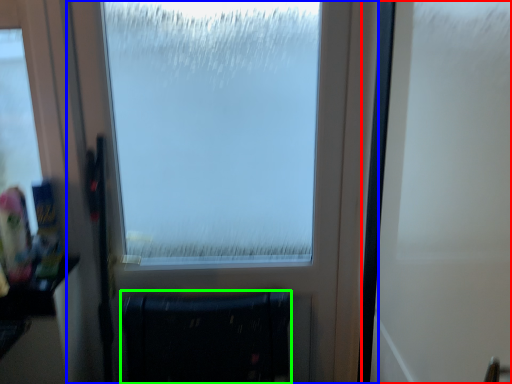
Question: Considering the real-world distances, which object is closest to screen door (highlighted by a red box)? window (highlighted by a blue box) or furniture (highlighted by a green box).

Choices:
 (A) window
 (B) furniture

Answer: (A)